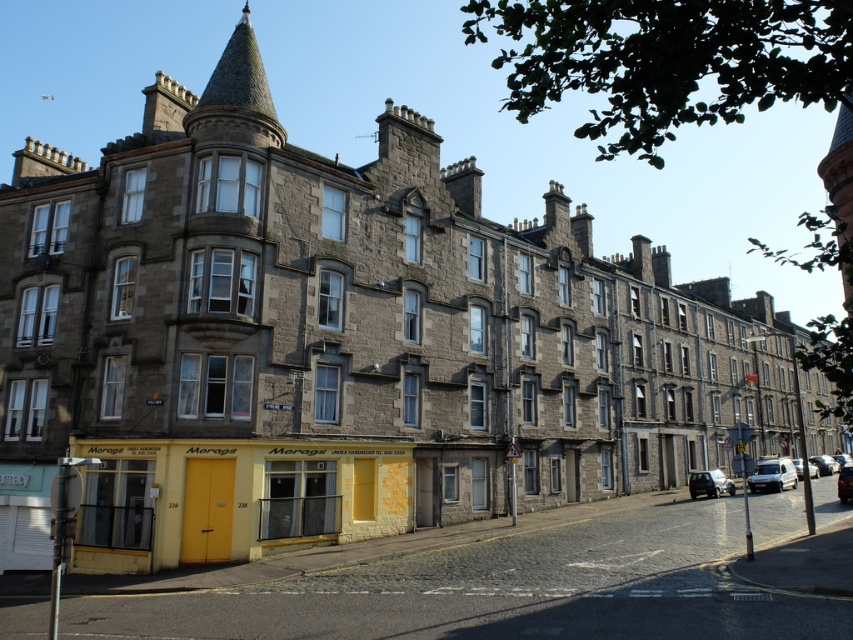
Does white matte van at lower right appear under silver metallic car at center?

Actually, white matte van at lower right is above silver metallic car at center.

Describe the element at coordinates (772, 476) in the screenshot. I see `white matte van at lower right` at that location.

Image resolution: width=853 pixels, height=640 pixels. Find the location of `white matte van at lower right`. white matte van at lower right is located at coordinates (772, 476).

Between white matte van at lower right and metallic silver car at center, which one has more height?

Standing taller between the two is metallic silver car at center.

Between white matte van at lower right and metallic silver car at center, which one appears on the left side from the viewer's perspective?

white matte van at lower right

You are a GUI agent. You are given a task and a screenshot of the screen. Output one action in this format:
    pyautogui.click(x=<x>, y=<y>)
    Task: Click on the white matte van at lower right
    This screenshot has height=640, width=853.
    Given the screenshot: What is the action you would take?
    pyautogui.click(x=772, y=476)

Is point (712, 486) behind point (846, 477)?

Yes, it is behind point (846, 477).

Which is more to the right, metallic silver car at lower right or metallic silver car at center?

metallic silver car at center

Does point (701, 492) lie behind point (837, 486)?

Yes.

This screenshot has height=640, width=853. I want to click on metallic silver car at lower right, so click(x=709, y=483).